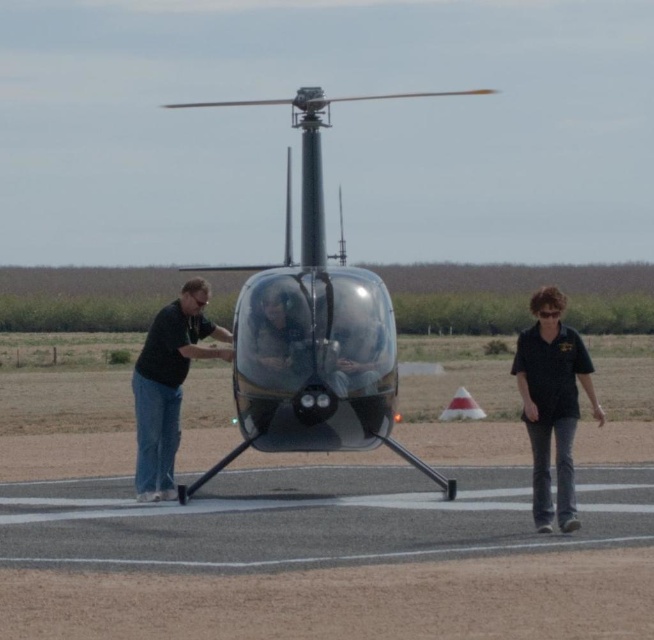
Question: Does smooth asphalt tarmac at center appear over black matte shirt at center?

Choices:
 (A) no
 (B) yes

Answer: (A)

Question: Which point is closer to the camera?

Choices:
 (A) (192, 324)
 (B) (560, 332)

Answer: (B)

Question: Observing the image, what is the correct spatial positioning of smooth asphalt tarmac at center in reference to black matte shirt at center?

Choices:
 (A) below
 (B) above

Answer: (A)

Question: Is smooth asphalt tarmac at center below black matte shirt at center?

Choices:
 (A) no
 (B) yes

Answer: (B)

Question: Among these objects, which one is nearest to the camera?

Choices:
 (A) smooth asphalt tarmac at center
 (B) matte black shirt at left
 (C) glossy metallic helicopter at center
 (D) black matte shirt at center

Answer: (A)

Question: Which point is closer to the camera?

Choices:
 (A) black matte shirt at center
 (B) smooth asphalt tarmac at center
 (C) matte black shirt at left

Answer: (B)